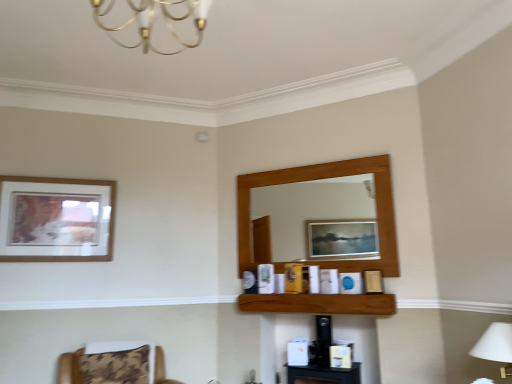
Question: From a real-world perspective, is brown fabric chair at lower left beneath gold metallic chandelier at upper center?

Choices:
 (A) no
 (B) yes

Answer: (B)

Question: Can we say brown fabric chair at lower left lies outside gold metallic chandelier at upper center?

Choices:
 (A) yes
 (B) no

Answer: (A)

Question: Is brown fabric chair at lower left at the right side of gold metallic chandelier at upper center?

Choices:
 (A) yes
 (B) no

Answer: (B)

Question: Is brown fabric chair at lower left oriented towards gold metallic chandelier at upper center?

Choices:
 (A) yes
 (B) no

Answer: (B)

Question: Is brown fabric chair at lower left positioned in front of gold metallic chandelier at upper center?

Choices:
 (A) no
 (B) yes

Answer: (A)

Question: Considering the positions of point (98, 13) and point (97, 379), is point (98, 13) closer or farther from the camera than point (97, 379)?

Choices:
 (A) closer
 (B) farther

Answer: (A)

Question: Is gold metallic chandelier at upper center taller or shorter than brown fabric chair at lower left?

Choices:
 (A) short
 (B) tall

Answer: (B)

Question: From a real-world perspective, is gold metallic chandelier at upper center positioned above or below brown fabric chair at lower left?

Choices:
 (A) above
 (B) below

Answer: (A)

Question: In terms of width, does gold metallic chandelier at upper center look wider or thinner when compared to brown fabric chair at lower left?

Choices:
 (A) wide
 (B) thin

Answer: (B)

Question: From the image's perspective, is brown fabric chair at lower left above or below white fabric lampshade at lower right?

Choices:
 (A) below
 (B) above

Answer: (A)

Question: Is point (139, 344) positioned closer to the camera than point (509, 342)?

Choices:
 (A) farther
 (B) closer

Answer: (A)

Question: Is brown fabric chair at lower left in front of or behind white fabric lampshade at lower right in the image?

Choices:
 (A) front
 (B) behind

Answer: (B)

Question: Is brown fabric chair at lower left inside or outside of white fabric lampshade at lower right?

Choices:
 (A) outside
 (B) inside

Answer: (A)

Question: Would you say brown wooden shelf at center is inside or outside gold metallic chandelier at upper center?

Choices:
 (A) outside
 (B) inside

Answer: (A)

Question: From a real-world perspective, is brown wooden shelf at center positioned above or below gold metallic chandelier at upper center?

Choices:
 (A) below
 (B) above

Answer: (A)